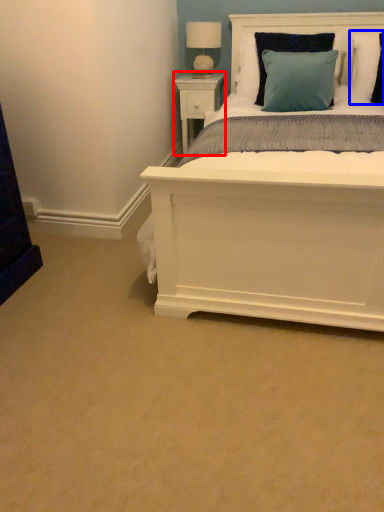
Question: Which object appears farthest to the camera in this image, nightstand (highlighted by a red box) or pillow (highlighted by a blue box)?

Choices:
 (A) nightstand
 (B) pillow

Answer: (A)